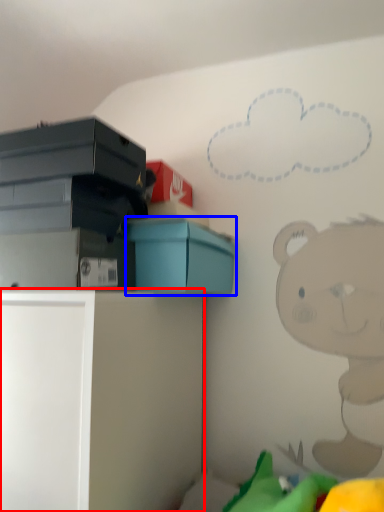
Question: Which point is further to the camera, furniture (highlighted by a red box) or box (highlighted by a blue box)?

Choices:
 (A) furniture
 (B) box

Answer: (B)